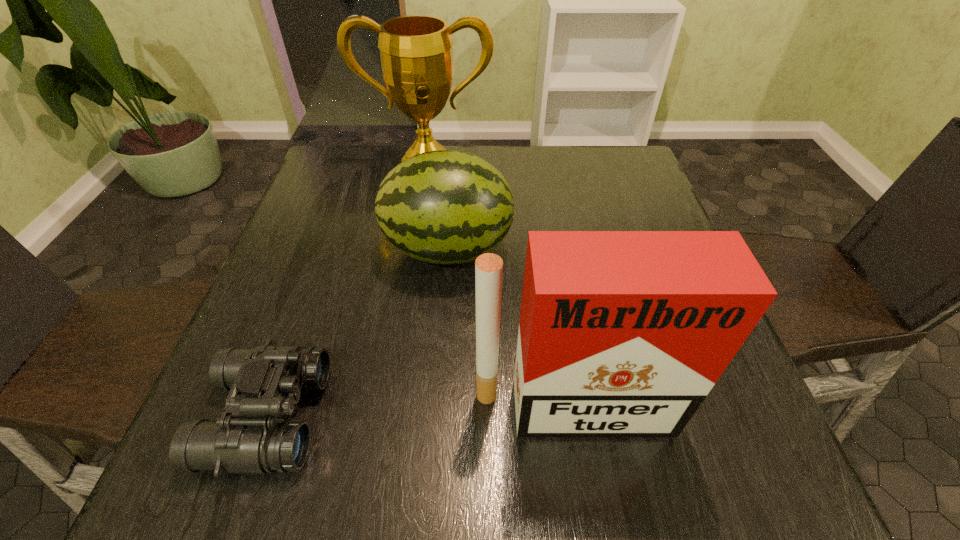
You are a GUI agent. You are given a task and a screenshot of the screen. Output one action in this format:
    pyautogui.click(x=<x>, y=<y>)
    Task: Click on the object situated at the near edge
    This screenshot has width=960, height=540.
    Given the screenshot: What is the action you would take?
    pyautogui.click(x=264, y=382)

This screenshot has width=960, height=540. I want to click on award that is at the left edge, so [x=416, y=52].

You are a GUI agent. You are given a task and a screenshot of the screen. Output one action in this format:
    pyautogui.click(x=<x>, y=<y>)
    Task: Click on the binoculars that is at the left edge
    This screenshot has height=540, width=960.
    Given the screenshot: What is the action you would take?
    pyautogui.click(x=264, y=382)

I want to click on object that is positioned at the right edge, so click(622, 333).

You are a GUI agent. You are given a task and a screenshot of the screen. Output one action in this format:
    pyautogui.click(x=<x>, y=<y>)
    Task: Click on the object that is at the far left corner
    Image resolution: width=960 pixels, height=540 pixels.
    Given the screenshot: What is the action you would take?
    pos(416,52)

Where is `object at the near left corner`? This screenshot has width=960, height=540. object at the near left corner is located at coordinates tap(264, 382).

Where is `vacant area at the far edge`? This screenshot has height=540, width=960. vacant area at the far edge is located at coordinates (565, 187).

Where is `vacant region at the left edge of the desktop`? vacant region at the left edge of the desktop is located at coordinates (311, 249).

What are the coordinates of `free space at the far left corner` in the screenshot? It's located at (329, 194).

Locate an element on the screen. blank space at the near right corner of the desktop is located at coordinates (688, 501).